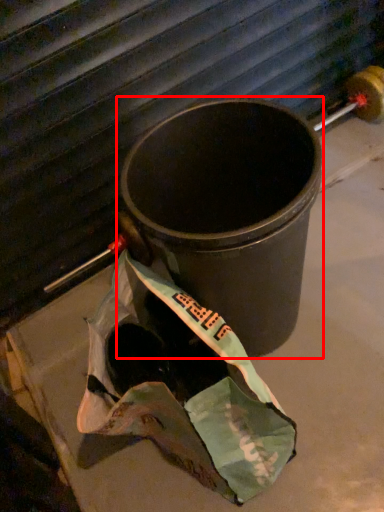
Question: In this image, where is waste container (annotated by the red box) located relative to grocery bag?

Choices:
 (A) left
 (B) right

Answer: (B)